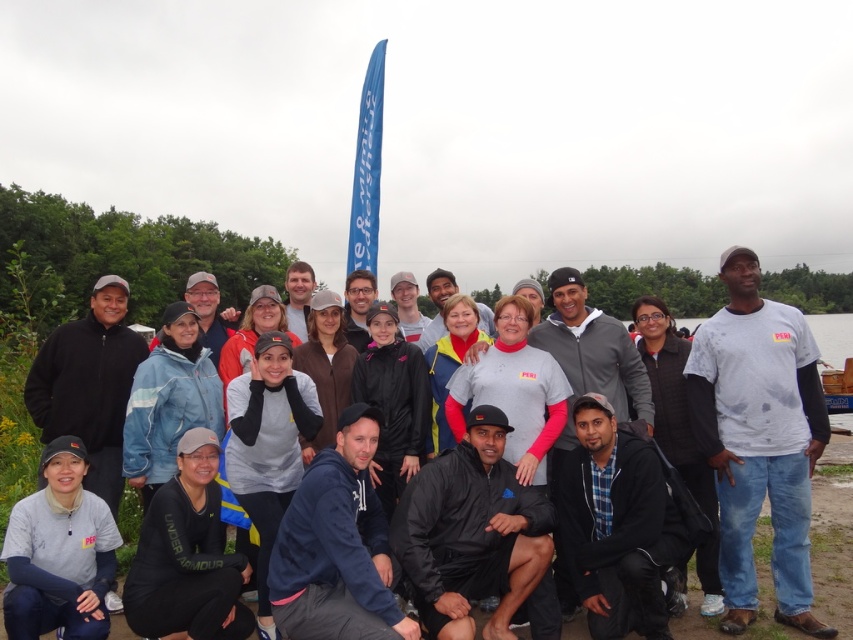
You are standing in front of the group and want to take a photo that includes both the point at position (614, 424) and the point at position (358, 333). Since the points have different distances from the camera, which point should you focus on to ensure both are in sharp focus?

You should focus on point (358, 333) because it is farther from the camera than point (614, 424). By focusing on the farther point, the closer point will also be within the depth of field, ensuring both are sharp.

You are part of the group in the image and want to locate the white cotton shirt at center and the matte black jacket at center. Which one is positioned to the right of the other?

The white cotton shirt at center is to the right of the matte black jacket at center.